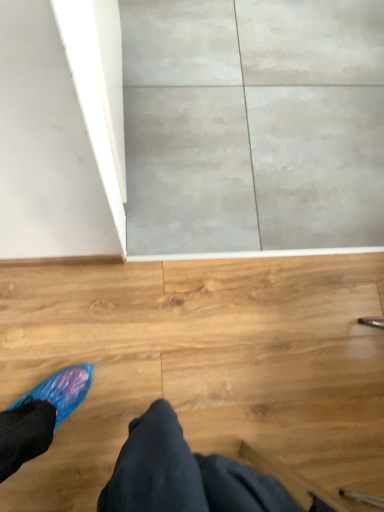
Question: Does blue plastic shoe at lower left have a lesser width compared to gray concrete wall at upper center?

Choices:
 (A) yes
 (B) no

Answer: (A)

Question: Considering the relative sizes of blue plastic shoe at lower left and gray concrete wall at upper center in the image provided, is blue plastic shoe at lower left shorter than gray concrete wall at upper center?

Choices:
 (A) yes
 (B) no

Answer: (B)

Question: From the image's perspective, does blue plastic shoe at lower left appear lower than gray concrete wall at upper center?

Choices:
 (A) no
 (B) yes

Answer: (B)

Question: Can you confirm if blue plastic shoe at lower left is positioned to the right of gray concrete wall at upper center?

Choices:
 (A) yes
 (B) no

Answer: (B)

Question: Is gray concrete wall at upper center at the back of blue plastic shoe at lower left?

Choices:
 (A) no
 (B) yes

Answer: (A)

Question: Does blue plastic shoe at lower left have a smaller size compared to gray concrete wall at upper center?

Choices:
 (A) no
 (B) yes

Answer: (A)

Question: From the image's perspective, is gray concrete wall at upper center under blue plastic shoe at lower left?

Choices:
 (A) no
 (B) yes

Answer: (A)

Question: Does gray concrete wall at upper center have a greater width compared to blue plastic shoe at lower left?

Choices:
 (A) yes
 (B) no

Answer: (A)

Question: Is gray concrete wall at upper center to the right of blue plastic shoe at lower left from the viewer's perspective?

Choices:
 (A) no
 (B) yes

Answer: (B)

Question: Is gray concrete wall at upper center positioned far away from blue plastic shoe at lower left?

Choices:
 (A) yes
 (B) no

Answer: (B)

Question: Does gray concrete wall at upper center have a greater height compared to blue plastic shoe at lower left?

Choices:
 (A) yes
 (B) no

Answer: (B)

Question: Is blue plastic shoe at lower left inside gray concrete wall at upper center?

Choices:
 (A) yes
 (B) no

Answer: (B)

Question: From the image's perspective, relative to gray concrete wall at upper center, is blue plastic shoe at lower left above or below?

Choices:
 (A) above
 (B) below

Answer: (B)